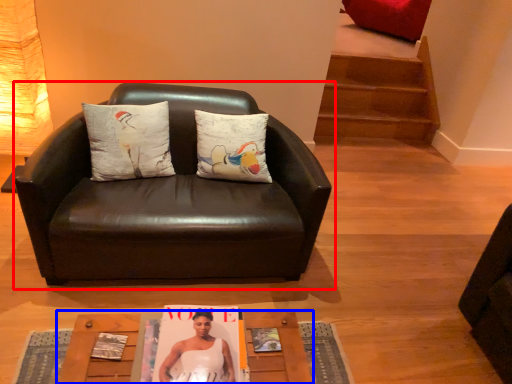
Question: Which object is closer to the camera taking this photo, chair (highlighted by a red box) or table (highlighted by a blue box)?

Choices:
 (A) chair
 (B) table

Answer: (B)